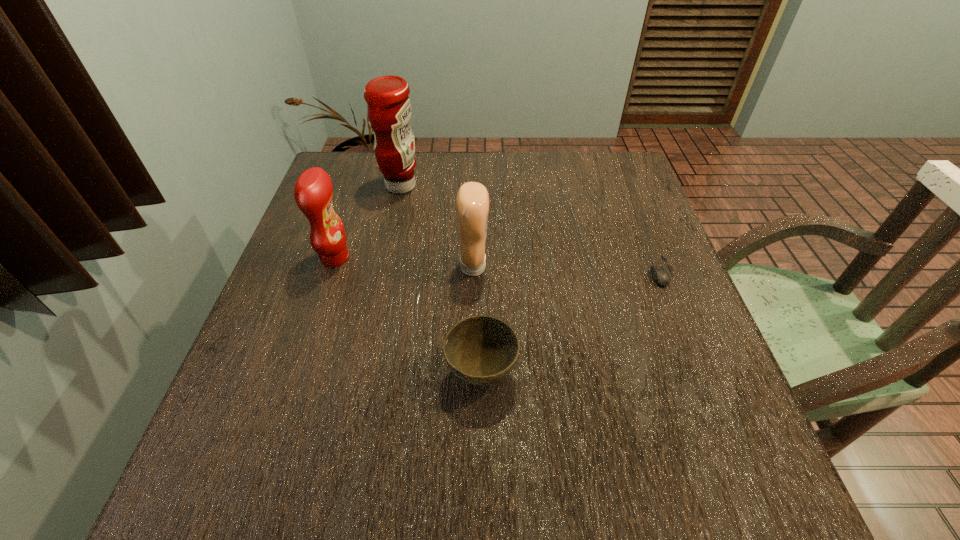
What are the coordinates of `free space at the far right corner of the desktop` in the screenshot? It's located at click(617, 161).

What are the coordinates of `empty location between the leftmost condiment and the mouse` in the screenshot? It's located at (497, 265).

Find the location of a particular element. free area in between the bowl and the mouse is located at coordinates (571, 322).

The height and width of the screenshot is (540, 960). I want to click on vacant region between the leftmost object and the tallest condiment, so click(x=368, y=222).

At what (x,y) coordinates should I click in order to perform the action: click on free space between the rightmost condiment and the rightmost object. Please return your answer as a coordinate pair (x, y). This screenshot has height=540, width=960. Looking at the image, I should click on (567, 269).

Locate an element on the screen. The image size is (960, 540). vacant space that is in between the shortest object and the nearest object is located at coordinates (571, 322).

Where is `vacant area that lies between the mouse and the tallest object`? vacant area that lies between the mouse and the tallest object is located at coordinates (531, 228).

Where is `vacant space that's between the shortest object and the bowl`? vacant space that's between the shortest object and the bowl is located at coordinates (571, 322).

Locate an element on the screen. The image size is (960, 540). free space between the leftmost object and the fourth object from right to left is located at coordinates (368, 222).

At what (x,y) coordinates should I click in order to perform the action: click on the closest object to the rightmost condiment. Please return your answer as a coordinate pair (x, y). This screenshot has width=960, height=540. Looking at the image, I should click on click(481, 350).